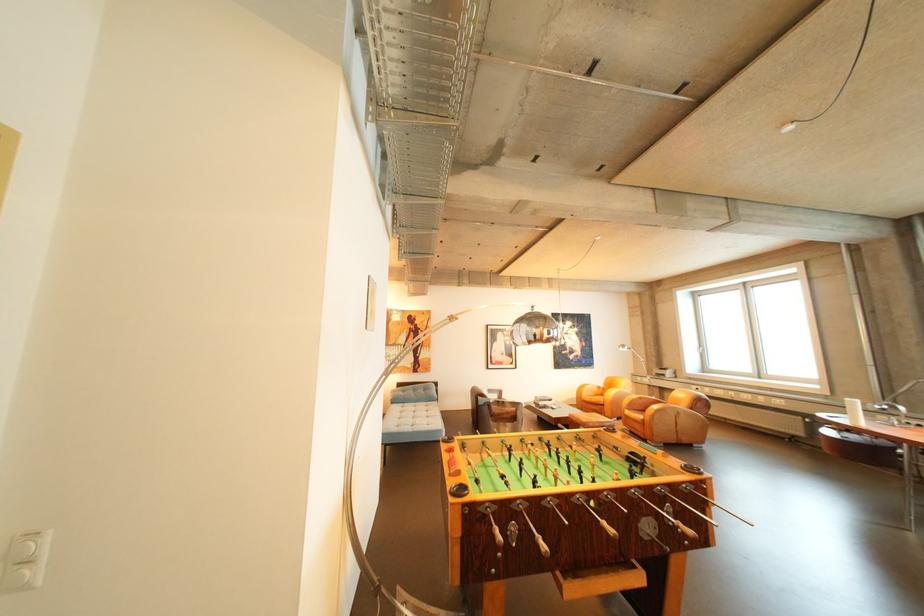
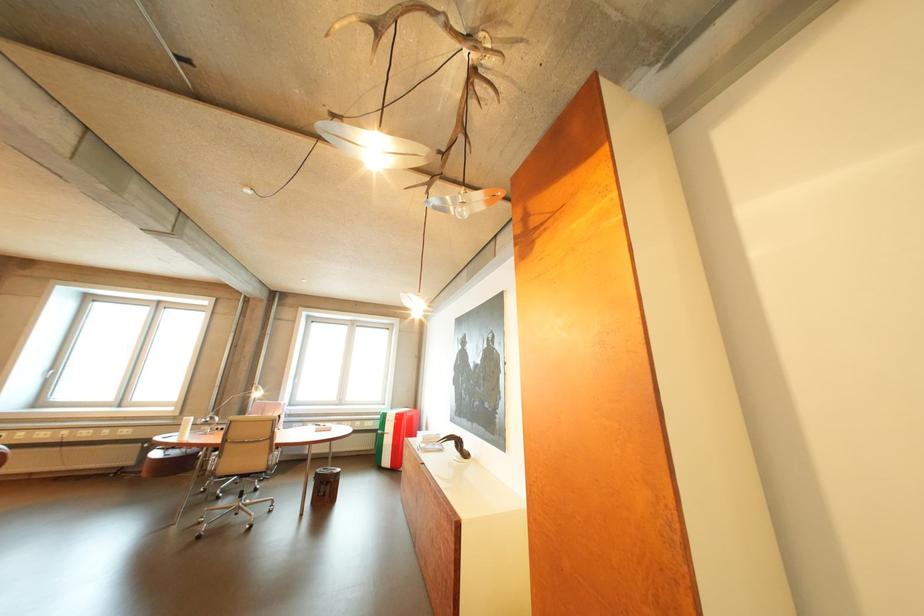
How did the camera likely rotate?

The camera rotated toward right-up.